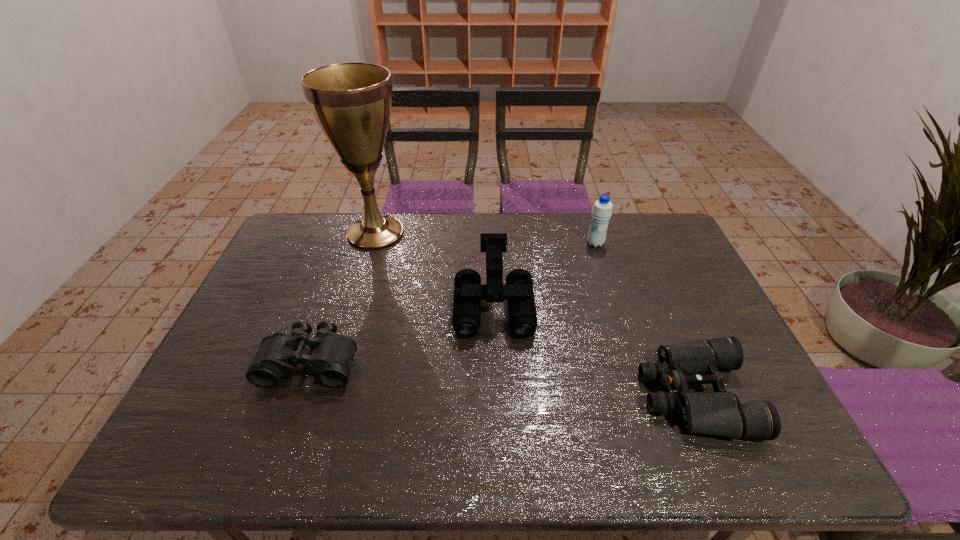
Find the location of a particular element. The width and height of the screenshot is (960, 540). object that can be found as the fourth closest to the leftmost binoculars is located at coordinates (602, 210).

Locate an element on the screen. The height and width of the screenshot is (540, 960). the second closest object to the water bottle is located at coordinates (720, 413).

Identify which binoculars is the closest to the trophy cup. Please provide its 2D coordinates. Your answer should be formatted as a tuple, i.e. [(x, y)], where the tuple contains the x and y coordinates of a point satisfying the conditions above.

[(466, 320)]

Where is `binoculars that stands as the closest to the rightmost binoculars`? The width and height of the screenshot is (960, 540). binoculars that stands as the closest to the rightmost binoculars is located at coordinates (466, 320).

Locate an element on the screen. The width and height of the screenshot is (960, 540). vacant region that satisfies the following two spatial constraints: 1. on the front side of the water bottle; 2. on the right side of the trophy cup is located at coordinates (372, 244).